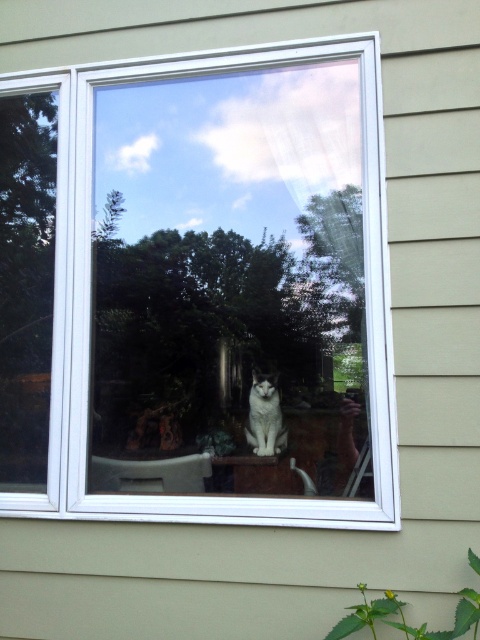
Which is in front, point (342, 465) or point (264, 419)?

Point (342, 465) is in front.

The width and height of the screenshot is (480, 640). What do you see at coordinates (197, 285) in the screenshot? I see `white plastic window at center` at bounding box center [197, 285].

You are a GUI agent. You are given a task and a screenshot of the screen. Output one action in this format:
    pyautogui.click(x=<x>, y=<y>)
    Task: Click on the white plastic window at center
    
    Given the screenshot: What is the action you would take?
    pyautogui.click(x=197, y=285)